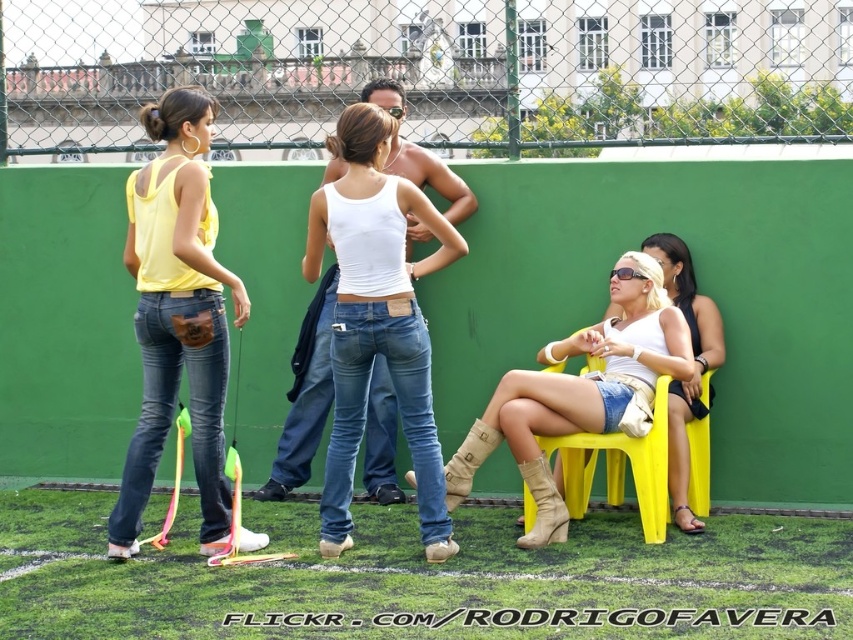
You are a photographer trying to capture a group photo of the two women and the man in the scene. You notice the white matte tank top at center and the matte white tank top at right. Which person should you ask to stand closer to the camera to ensure their tank top appears larger in the photo?

The person wearing the white matte tank top at center should be asked to stand closer to the camera because their tank top already has a greater height compared to the matte white tank top at right, so moving closer would make it appear even larger.

You are a fashion designer observing the two women in the image. You notice the yellow matte tank top at left and the matte white tank top at right. Which tank top appears larger in size?

The yellow matte tank top at left appears larger than the matte white tank top at right.